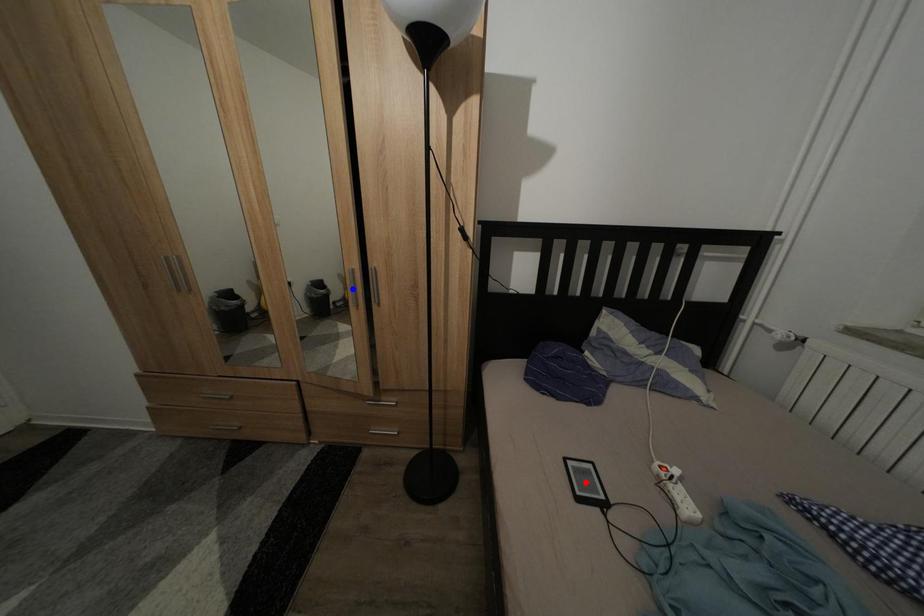
Question: In the image, two points are highlighted. Which point is nearer to the camera? Reply with the corresponding letter.

Choices:
 (A) blue point
 (B) red point

Answer: (B)